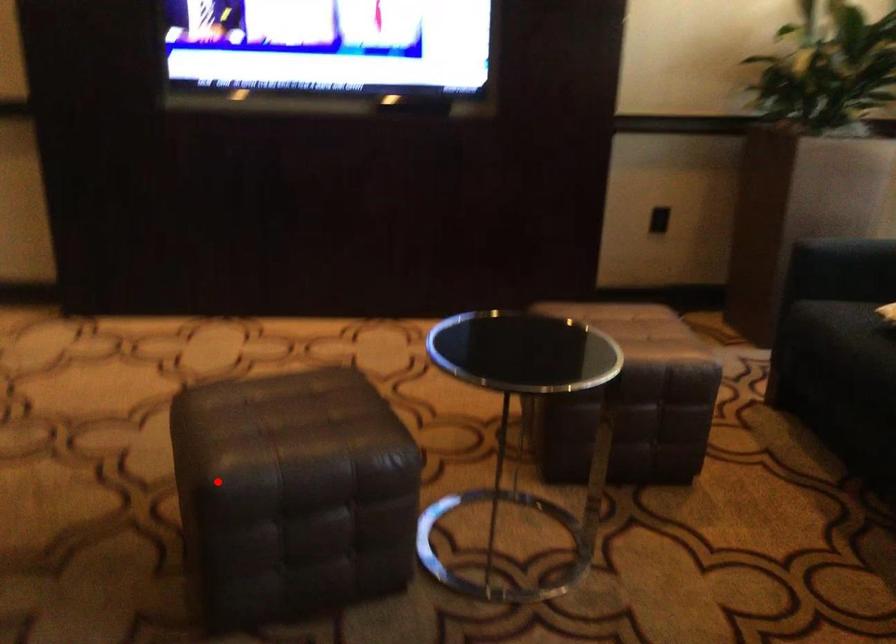
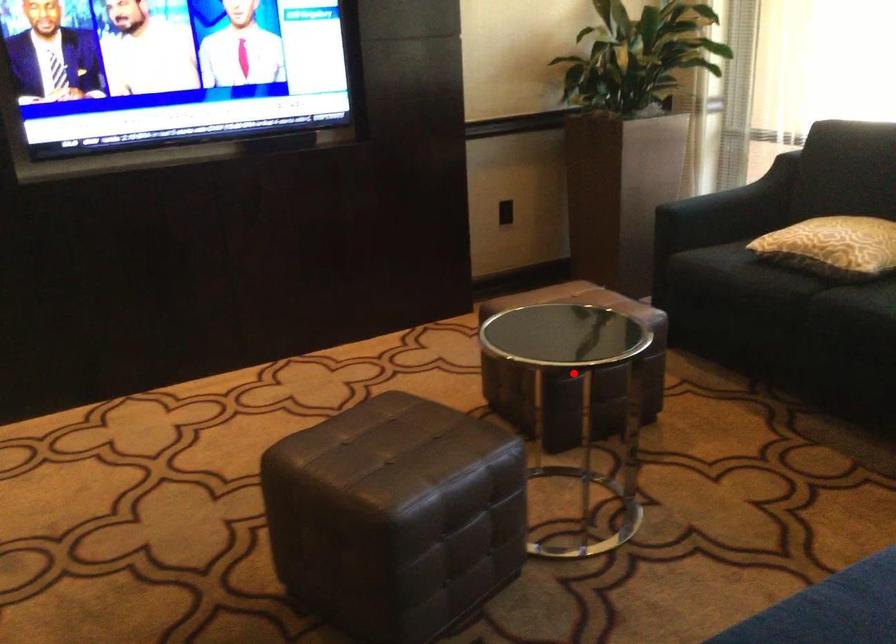
Looking at this image, I am providing you with two images of the same scene from different viewpoints. A red point is marked on the first image and another point is marked on the second image. Is the red point in image1 aligned with the point shown in image2?

No